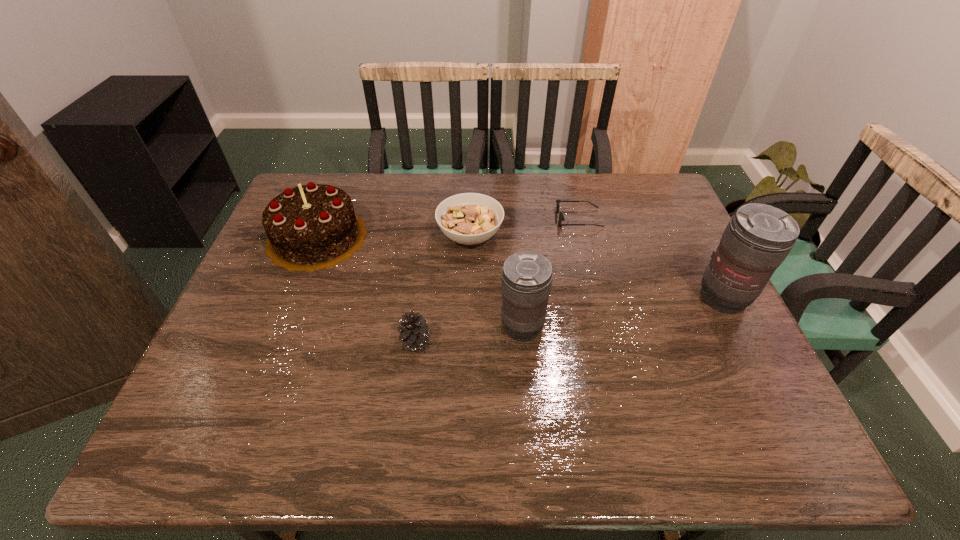
Please show where to add a telephoto lens on the left while keeping spacing even. Please provide its 2D coordinates. Your answer should be formatted as a tuple, i.e. [(x, y)], where the tuple contains the x and y coordinates of a point satisfying the conditions above.

[(294, 359)]